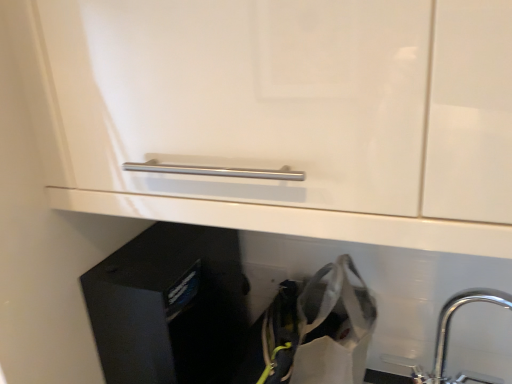
Question: From the image's perspective, does chrome metallic tap at lower right appear higher than white fabric shopping bag at lower right?

Choices:
 (A) no
 (B) yes

Answer: (B)

Question: Does chrome metallic tap at lower right have a greater width compared to white fabric shopping bag at lower right?

Choices:
 (A) yes
 (B) no

Answer: (B)

Question: Is chrome metallic tap at lower right to the left of white fabric shopping bag at lower right from the viewer's perspective?

Choices:
 (A) yes
 (B) no

Answer: (B)

Question: Can you confirm if chrome metallic tap at lower right is positioned to the right of white fabric shopping bag at lower right?

Choices:
 (A) no
 (B) yes

Answer: (B)

Question: Would you say chrome metallic tap at lower right contains white fabric shopping bag at lower right?

Choices:
 (A) yes
 (B) no

Answer: (B)

Question: Choose the correct answer: Is black matte file cabinet at lower left inside chrome metallic tap at lower right or outside it?

Choices:
 (A) inside
 (B) outside

Answer: (B)

Question: Visually, is black matte file cabinet at lower left positioned to the left or to the right of chrome metallic tap at lower right?

Choices:
 (A) left
 (B) right

Answer: (A)

Question: Considering the positions of black matte file cabinet at lower left and chrome metallic tap at lower right in the image, is black matte file cabinet at lower left bigger or smaller than chrome metallic tap at lower right?

Choices:
 (A) small
 (B) big

Answer: (B)

Question: From the image's perspective, relative to chrome metallic tap at lower right, is black matte file cabinet at lower left above or below?

Choices:
 (A) below
 (B) above

Answer: (B)

Question: From a real-world perspective, relative to black matte file cabinet at lower left, is white fabric shopping bag at lower right vertically above or below?

Choices:
 (A) above
 (B) below

Answer: (B)

Question: Is white fabric shopping bag at lower right spatially inside black matte file cabinet at lower left, or outside of it?

Choices:
 (A) outside
 (B) inside

Answer: (A)

Question: Considering the positions of point (347, 334) and point (141, 243), is point (347, 334) closer or farther from the camera than point (141, 243)?

Choices:
 (A) farther
 (B) closer

Answer: (B)

Question: Would you say white fabric shopping bag at lower right is to the left or to the right of black matte file cabinet at lower left in the picture?

Choices:
 (A) right
 (B) left

Answer: (A)

Question: From a real-world perspective, is black matte file cabinet at lower left above or below white fabric shopping bag at lower right?

Choices:
 (A) below
 (B) above

Answer: (B)

Question: In the image, is black matte file cabinet at lower left positioned in front of or behind white fabric shopping bag at lower right?

Choices:
 (A) behind
 (B) front

Answer: (A)